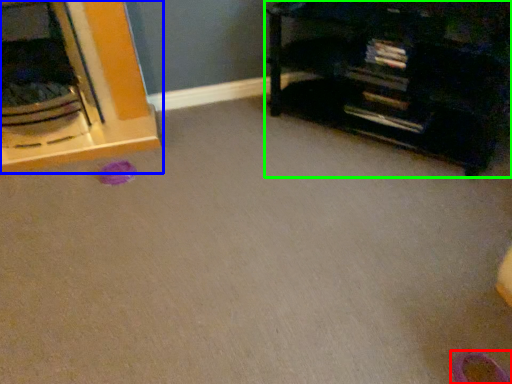
Question: Which is nearer to the shoe (highlighted by a red box)? furniture (highlighted by a blue box) or furniture (highlighted by a green box).

Choices:
 (A) furniture
 (B) furniture

Answer: (B)